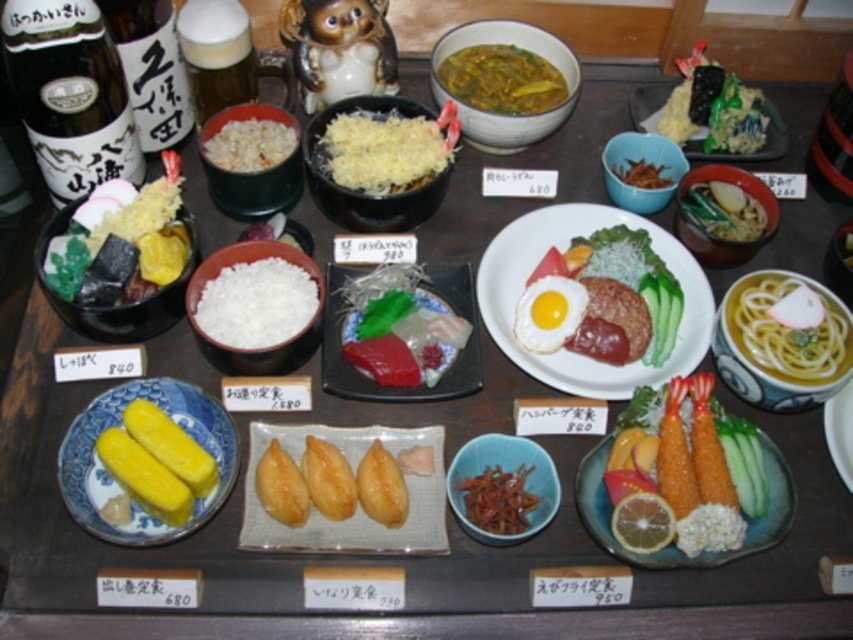
Question: Which object is positioned farthest from the green leafy vegetable at upper right?

Choices:
 (A) yellowish broth with noodles at upper center
 (B) translucent glass plate at center
 (C) white rice at center

Answer: (C)

Question: Is sunny-side egg at center wider than shredded cheese at center?

Choices:
 (A) yes
 (B) no

Answer: (B)

Question: From the image, what is the correct spatial relationship of yellow noodle soup at right in relation to white matte rice at center?

Choices:
 (A) right
 (B) left

Answer: (A)

Question: Based on their relative distances, which object is farther from the white rice at center?

Choices:
 (A) yellow noodle soup at right
 (B) yellowish broth with noodles at upper center
 (C) shiny green leafy vegetable at center right

Answer: (A)

Question: Which object is the farthest from the sunny-side egg at center?

Choices:
 (A) golden fried shrimp at center
 (B) green leafy vegetable at center
 (C) golden fried dumplings at center
 (D) matte black bowl at left

Answer: (D)

Question: Does matte black bowl at left have a lesser width compared to shiny green leafy vegetable at center right?

Choices:
 (A) yes
 (B) no

Answer: (B)